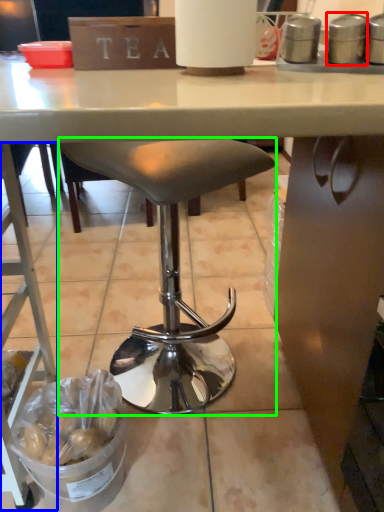
Question: Based on their relative distances, which object is farther from appliance (highlighted by a red box)? Choose from ladder (highlighted by a blue box) and stool (highlighted by a green box).

Choices:
 (A) ladder
 (B) stool

Answer: (A)